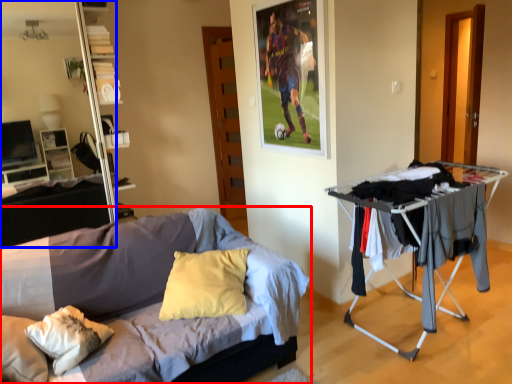
Question: Which object is further to the camera taking this photo, bed (highlighted by a red box) or entertainment center (highlighted by a blue box)?

Choices:
 (A) bed
 (B) entertainment center

Answer: (B)